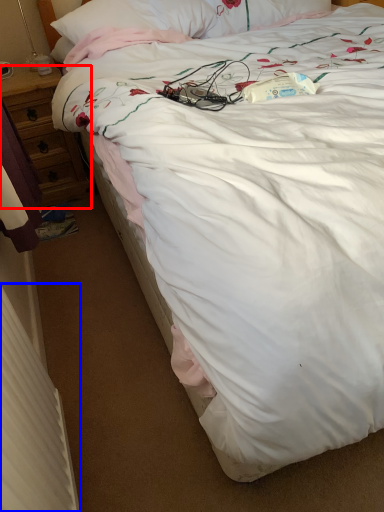
Question: Which of the following is the farthest to the observer, desk (highlighted by a red box) or radiator (highlighted by a blue box)?

Choices:
 (A) desk
 (B) radiator

Answer: (A)